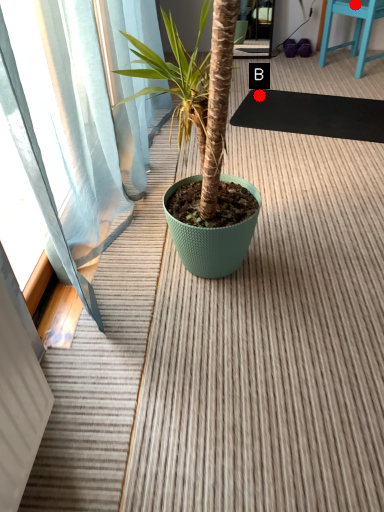
Question: Two points are circled on the image, labeled by A and B beside each circle. Which point is closer to the camera?

Choices:
 (A) A is closer
 (B) B is closer

Answer: (A)